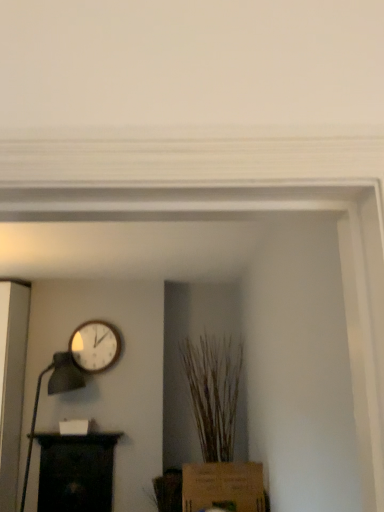
Question: Is the depth of black wood shelf at lower left greater than that of matte black table lamp at left?

Choices:
 (A) no
 (B) yes

Answer: (B)

Question: Is matte black table lamp at left at the back of black wood shelf at lower left?

Choices:
 (A) yes
 (B) no

Answer: (A)

Question: From the image's perspective, is black wood shelf at lower left under matte black table lamp at left?

Choices:
 (A) yes
 (B) no

Answer: (A)

Question: From the image's perspective, is black wood shelf at lower left located above matte black table lamp at left?

Choices:
 (A) yes
 (B) no

Answer: (B)

Question: Is black wood shelf at lower left thinner than matte black table lamp at left?

Choices:
 (A) yes
 (B) no

Answer: (A)

Question: Does point pyautogui.click(x=59, y=444) appear closer or farther from the camera than point pyautogui.click(x=203, y=505)?

Choices:
 (A) farther
 (B) closer

Answer: (A)

Question: Is black wood shelf at lower left bigger or smaller than brown cardboard box at lower center?

Choices:
 (A) small
 (B) big

Answer: (A)

Question: Relative to brown cardboard box at lower center, is black wood shelf at lower left in front or behind?

Choices:
 (A) behind
 (B) front

Answer: (A)

Question: In terms of height, does black wood shelf at lower left look taller or shorter compared to brown cardboard box at lower center?

Choices:
 (A) tall
 (B) short

Answer: (A)

Question: From the image's perspective, is brown textured plant at center positioned above or below wooden wall clock at upper left?

Choices:
 (A) below
 (B) above

Answer: (A)

Question: From a real-world perspective, is brown textured plant at center physically located above or below wooden wall clock at upper left?

Choices:
 (A) above
 (B) below

Answer: (B)

Question: Which is correct: brown textured plant at center is inside wooden wall clock at upper left, or outside of it?

Choices:
 (A) outside
 (B) inside

Answer: (A)

Question: Considering the positions of brown textured plant at center and wooden wall clock at upper left in the image, is brown textured plant at center wider or thinner than wooden wall clock at upper left?

Choices:
 (A) wide
 (B) thin

Answer: (A)

Question: Would you say brown cardboard box at lower center is to the left or to the right of matte black table lamp at left in the picture?

Choices:
 (A) right
 (B) left

Answer: (A)

Question: Is brown cardboard box at lower center wider or thinner than matte black table lamp at left?

Choices:
 (A) thin
 (B) wide

Answer: (B)